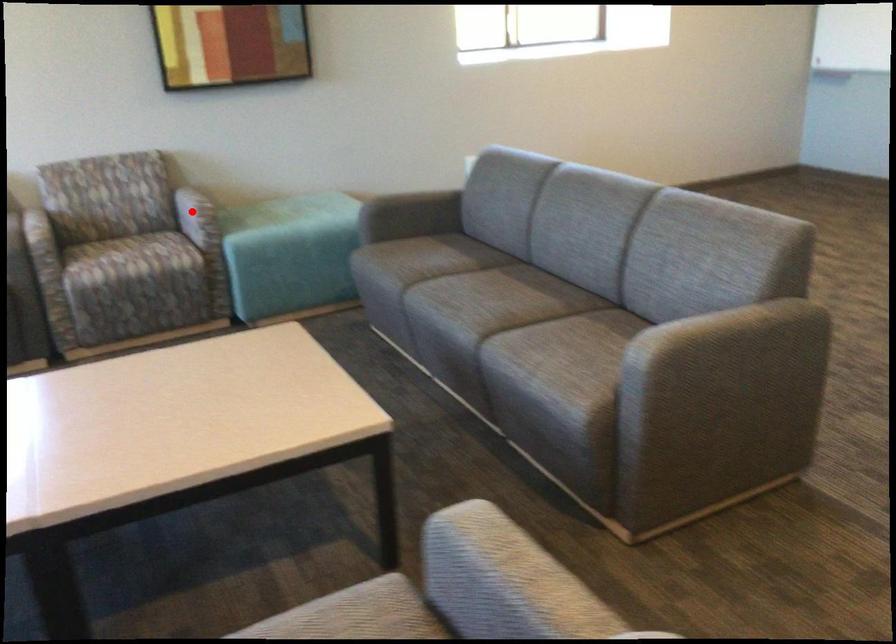
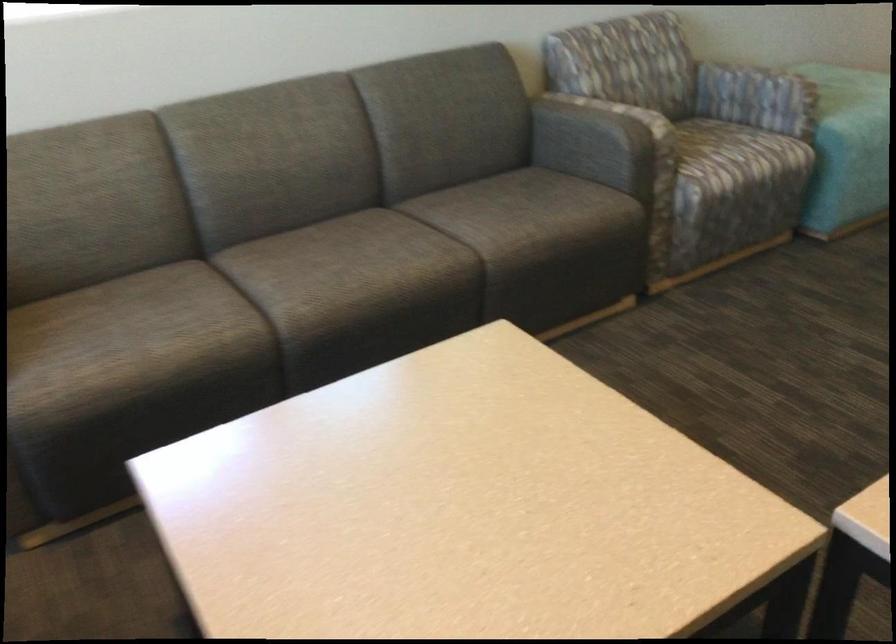
Question: I am providing you with two images of the same scene from different viewpoints. A red point is marked on the first image. At the location where the point appears in image 1, is it still visible in image 2?

Choices:
 (A) Yes
 (B) No

Answer: (A)